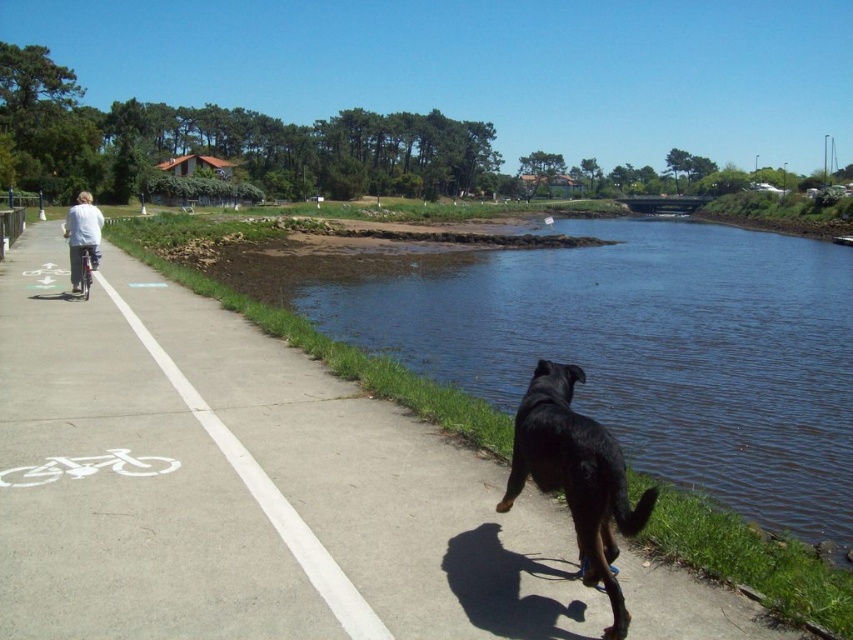
Does blue water at lower right appear on the right side of black glossy dog at lower center?

Correct, you'll find blue water at lower right to the right of black glossy dog at lower center.

At what (x,y) coordinates should I click in order to perform the action: click on blue water at lower right. Please return your answer as a coordinate pair (x, y). The width and height of the screenshot is (853, 640). Looking at the image, I should click on (643, 348).

The width and height of the screenshot is (853, 640). Find the location of `blue water at lower right`. blue water at lower right is located at coordinates (643, 348).

Is white cotton shirt at left smaller than shiny metallic bicycle at left?

No.

Is point (65, 234) positioned in front of point (86, 257)?

That is True.

Locate an element on the screen. The image size is (853, 640). white cotton shirt at left is located at coordinates (82, 236).

Which is in front, point (685, 460) or point (96, 211)?

Positioned in front is point (685, 460).

How much distance is there between blue water at lower right and white cotton shirt at left?

The distance of blue water at lower right from white cotton shirt at left is 24.83 meters.

In the scene shown: Who is more forward, (479, 307) or (74, 221)?

Point (74, 221) is in front.

Identify the location of blue water at lower right. (643, 348).